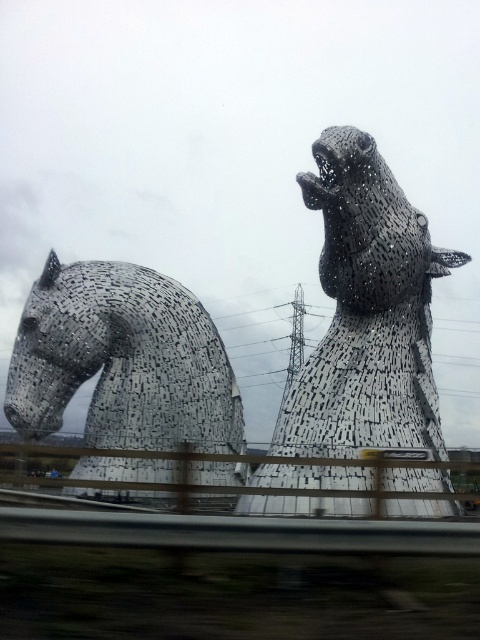
You are a photographer trying to capture the black textured horse at upper center in the image of The Kelpies. You notice a point at coordinates (367, 312). Where is this point located?

The point at coordinates (367, 312) is located on the black textured horse at upper center.

You are a photographer planning to capture both black textured horse at upper center and black textured horse at left in a single frame. Based on their sizes, which horse should you position closer to the center of your camera frame to ensure both are visible without cropping?

The black textured horse at upper center is taller than the black textured horse at left, so positioning the taller horse closer to the center of the camera frame will help ensure both are visible without cropping.

You are standing at the base of the left horse sculpture at The Kelpies in Helix Park. You want to take a photo of the point at coordinates point (441,490) which is on the right horse sculpture. Given that your camera has a maximum focus range of 100 feet, will you be able to capture this point clearly?

The point at coordinates point (441,490) is 99.74 feet from the camera, which is within the maximum focus range of 100 feet. Therefore, you will be able to capture this point clearly.